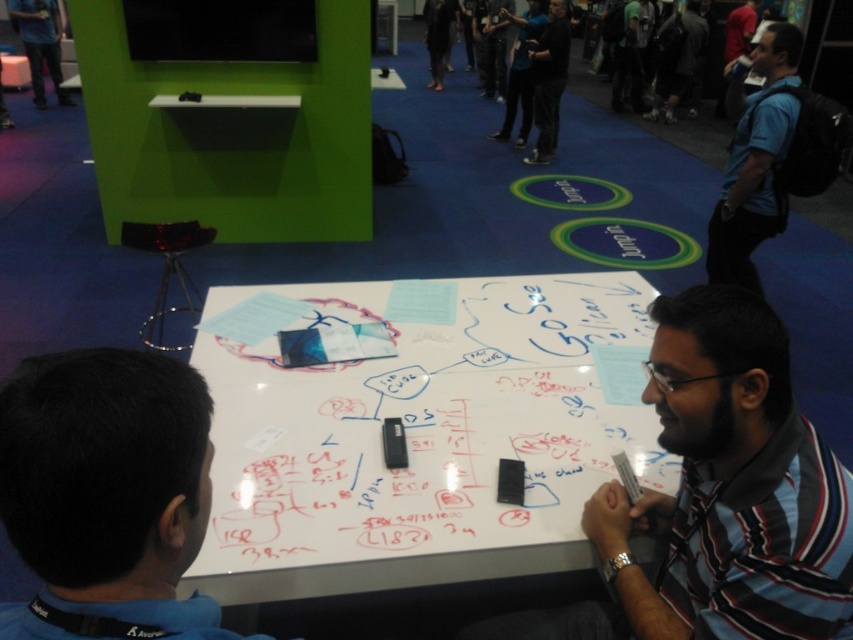
Does striped shirt at lower right come behind blue shirt at lower left?

Yes, striped shirt at lower right is behind blue shirt at lower left.

In the scene shown: Is striped shirt at lower right to the right of blue shirt at lower left from the viewer's perspective?

Indeed, striped shirt at lower right is positioned on the right side of blue shirt at lower left.

This screenshot has height=640, width=853. What do you see at coordinates (732, 486) in the screenshot?
I see `striped shirt at lower right` at bounding box center [732, 486].

Locate an element on the screen. striped shirt at lower right is located at coordinates (732, 486).

The height and width of the screenshot is (640, 853). What do you see at coordinates (419, 432) in the screenshot?
I see `white glossy table at center` at bounding box center [419, 432].

Is white glossy table at center behind blue shirt at right?

No.

Who is more forward, (416, 346) or (752, 138)?

Positioned in front is point (416, 346).

At what (x,y) coordinates should I click in order to perform the action: click on white glossy table at center. Please return your answer as a coordinate pair (x, y). Looking at the image, I should click on (419, 432).

Can you confirm if white glossy table at center is wider than black matte shirt at center?

Indeed, white glossy table at center has a greater width compared to black matte shirt at center.

Is white glossy table at center positioned in front of black matte shirt at center?

Yes.

Is point (198, 566) closer to camera compared to point (532, 74)?

Yes, it is in front of point (532, 74).

Identify the location of white glossy table at center. (419, 432).